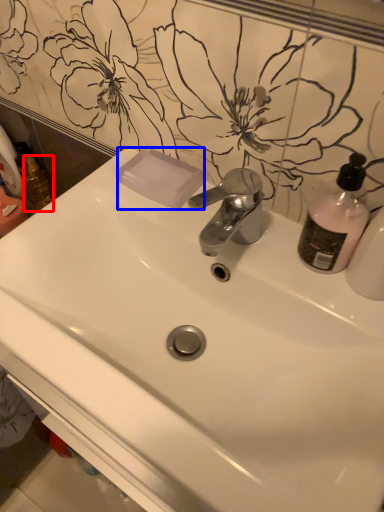
Question: Which point is closer to the camera, mouthwash (highlighted by a red box) or soap (highlighted by a blue box)?

Choices:
 (A) mouthwash
 (B) soap

Answer: (B)